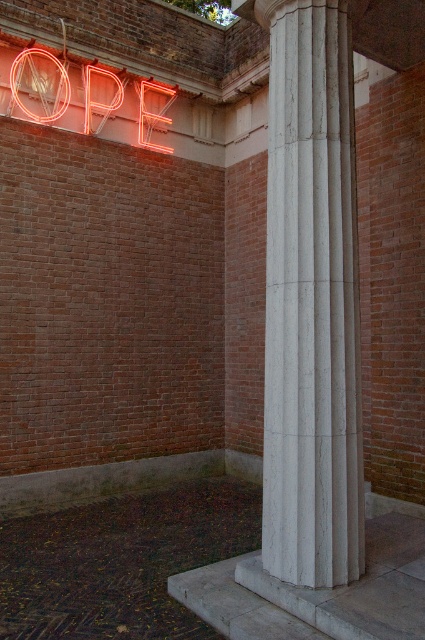
Question: Is the position of white marble column at center less distant than that of neontexturedsign at upper left?

Choices:
 (A) no
 (B) yes

Answer: (B)

Question: Which of the following is the farthest from the observer?

Choices:
 (A) neontexturedsign at upper left
 (B) white marble column at center

Answer: (A)

Question: Does white marble column at center have a larger size compared to neontexturedsign at upper left?

Choices:
 (A) no
 (B) yes

Answer: (A)

Question: Among these objects, which one is nearest to the camera?

Choices:
 (A) neontexturedsign at upper left
 (B) white marble column at center

Answer: (B)

Question: Does white marble column at center appear on the left side of neontexturedsign at upper left?

Choices:
 (A) yes
 (B) no

Answer: (B)